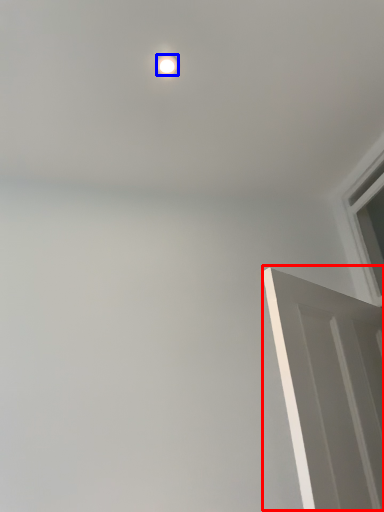
Question: Which object is further to the camera taking this photo, door (highlighted by a red box) or lighting (highlighted by a blue box)?

Choices:
 (A) door
 (B) lighting

Answer: (B)